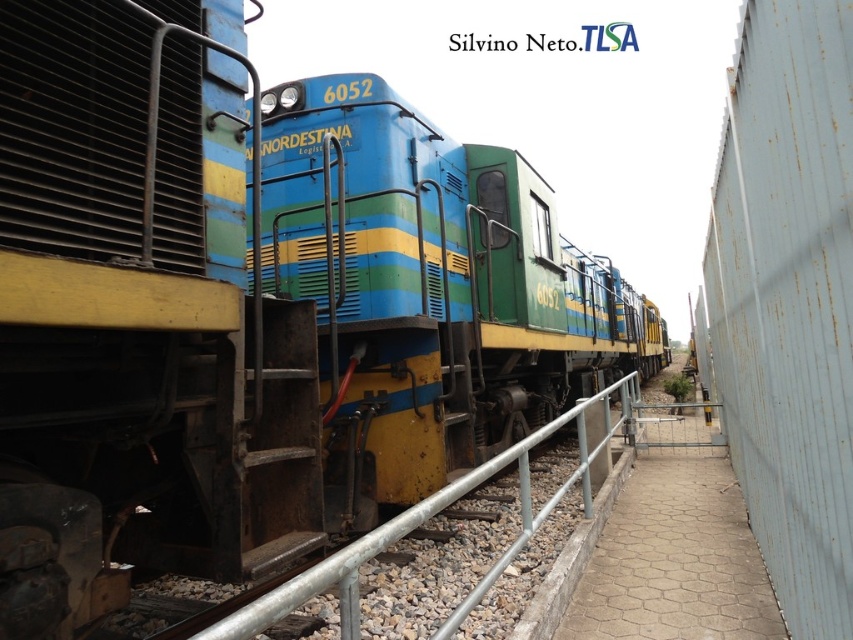
Question: Does rusty metal fence at right appear under metallic gray rail at center?

Choices:
 (A) yes
 (B) no

Answer: (B)

Question: Which of the following is the farthest from the observer?

Choices:
 (A) rusty metal fence at right
 (B) metallic gray rail at center

Answer: (A)

Question: Which point appears farthest from the camera in this image?

Choices:
 (A) (791, 616)
 (B) (405, 509)

Answer: (B)

Question: Can you confirm if rusty metal fence at right is bigger than metallic gray rail at center?

Choices:
 (A) no
 (B) yes

Answer: (A)

Question: Is rusty metal fence at right further to the viewer compared to metallic gray rail at center?

Choices:
 (A) no
 (B) yes

Answer: (B)